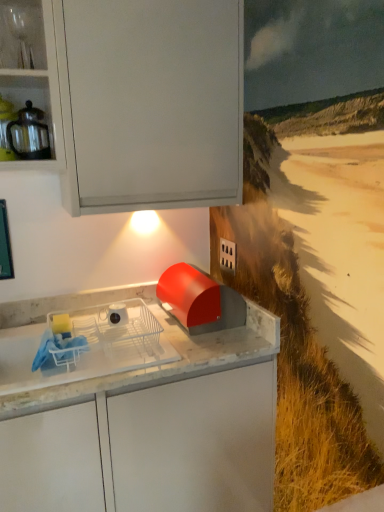
Question: Is clear glassware at upper left at the back of white glossy mug at center?

Choices:
 (A) no
 (B) yes

Answer: (A)

Question: Does white glossy mug at center have a greater width compared to clear glassware at upper left?

Choices:
 (A) yes
 (B) no

Answer: (A)

Question: Is clear glassware at upper left a part of white glossy mug at center?

Choices:
 (A) yes
 (B) no

Answer: (B)

Question: Are white glossy mug at center and clear glassware at upper left making contact?

Choices:
 (A) yes
 (B) no

Answer: (B)

Question: Considering the relative positions of white glossy mug at center and clear glassware at upper left in the image provided, is white glossy mug at center to the right of clear glassware at upper left from the viewer's perspective?

Choices:
 (A) no
 (B) yes

Answer: (B)

Question: Relative to matte glass teapot at upper left, is clear glassware at upper left in front or behind?

Choices:
 (A) behind
 (B) front

Answer: (B)

Question: Is point pyautogui.click(x=41, y=51) positioned closer to the camera than point pyautogui.click(x=21, y=144)?

Choices:
 (A) farther
 (B) closer

Answer: (A)

Question: From their relative heights in the image, would you say clear glassware at upper left is taller or shorter than matte glass teapot at upper left?

Choices:
 (A) short
 (B) tall

Answer: (A)

Question: From a real-world perspective, is clear glassware at upper left above or below matte glass teapot at upper left?

Choices:
 (A) below
 (B) above

Answer: (B)

Question: Considering the positions of point (107, 321) and point (34, 130), is point (107, 321) closer or farther from the camera than point (34, 130)?

Choices:
 (A) farther
 (B) closer

Answer: (A)

Question: Is white glossy mug at center bigger or smaller than matte glass teapot at upper left?

Choices:
 (A) big
 (B) small

Answer: (B)

Question: Relative to matte glass teapot at upper left, is white glossy mug at center in front or behind?

Choices:
 (A) front
 (B) behind

Answer: (B)

Question: Is white glossy mug at center to the left or to the right of matte glass teapot at upper left in the image?

Choices:
 (A) left
 (B) right

Answer: (B)

Question: Is white plastic dish rack at center wider or thinner than white glossy mug at center?

Choices:
 (A) wide
 (B) thin

Answer: (A)

Question: Considering the positions of point (23, 361) and point (124, 306), is point (23, 361) closer or farther from the camera than point (124, 306)?

Choices:
 (A) closer
 (B) farther

Answer: (A)